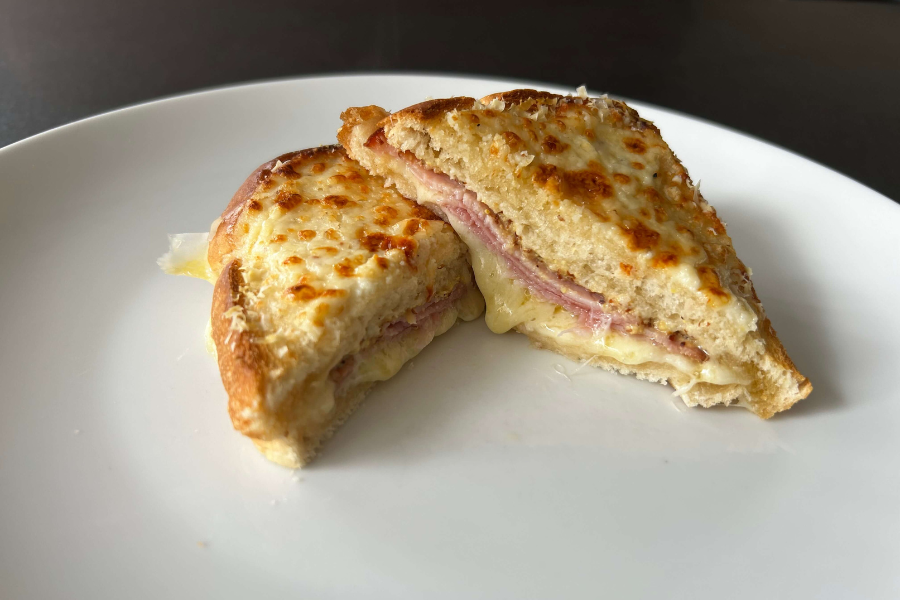
Identify the location of crumbs on plate. The image size is (900, 600). click(x=760, y=556), click(x=663, y=462), click(x=295, y=476), click(x=283, y=502), click(x=202, y=543).